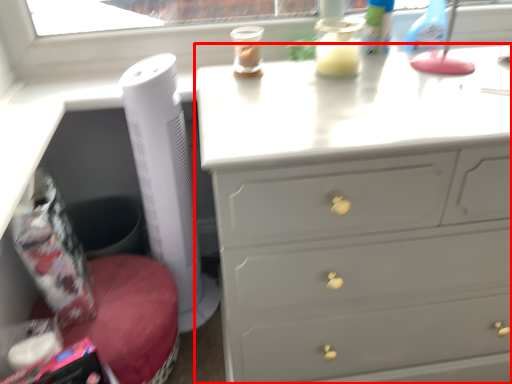
Question: Considering the relative positions of chest of drawers (annotated by the red box) and appliance in the image provided, where is chest of drawers (annotated by the red box) located with respect to the staircase?

Choices:
 (A) left
 (B) right

Answer: (B)